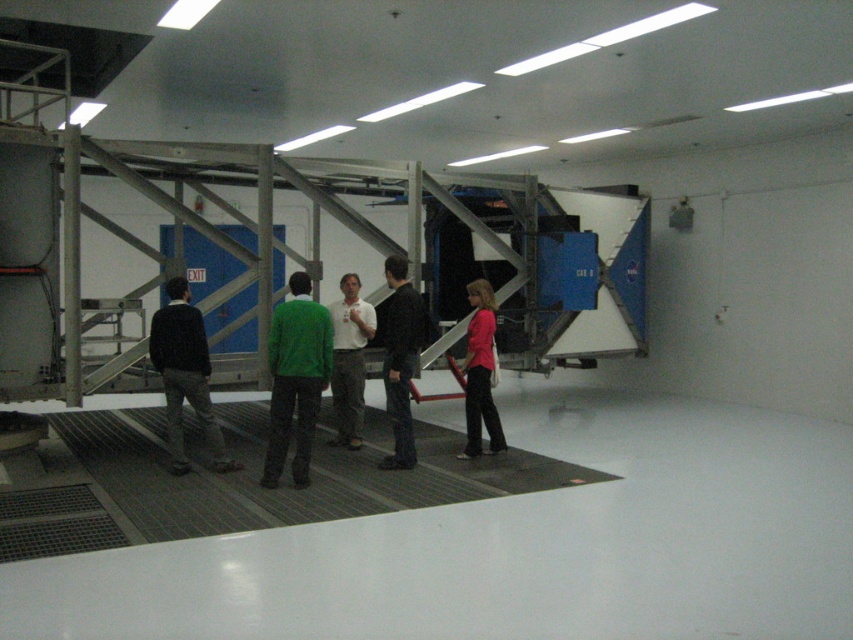
You are a researcher in the lab and need to locate the person wearing the green matte sweater at center and the white shirt at center. Which one is standing to the left of the other?

The green matte sweater at center is positioned on the left side of white shirt at center, so the green matte sweater at center is to the left of the white shirt at center.

You are standing in the laboratory and need to locate the white shirt at center and dark blue jeans at center. According to their positions, which one is on the left side?

The white shirt at center is on the left side because the dark blue jeans at center is to the right of it.